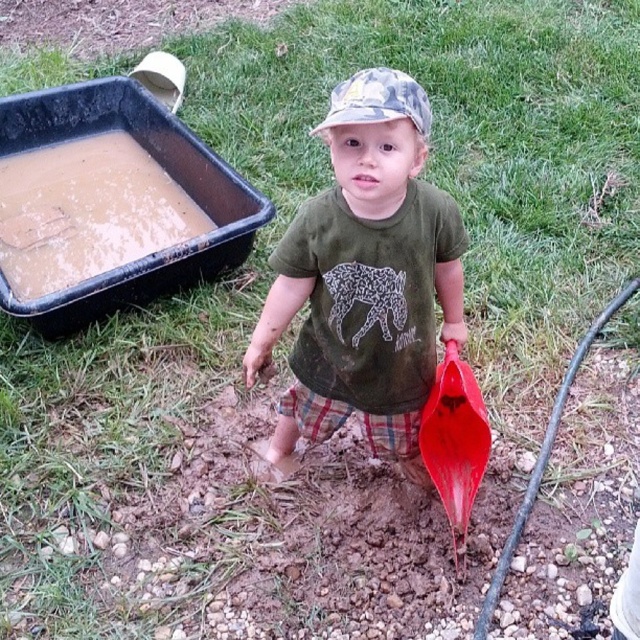
Based on the photo, does shiny plastic shovel at lower center have a lesser height compared to camouflage fabric cap at center?

No.

Is shiny plastic shovel at lower center smaller than camouflage fabric cap at center?

Incorrect, shiny plastic shovel at lower center is not smaller in size than camouflage fabric cap at center.

Find the location of `shiny plastic shovel at lower center`. shiny plastic shovel at lower center is located at coordinates (454, 444).

Which is below, green matte shirt at center or shiny plastic shovel at lower center?

Positioned lower is shiny plastic shovel at lower center.

Is point (349, 184) closer to viewer compared to point (464, 426)?

Yes, it is in front of point (464, 426).

Does point (406, 348) lie behind point (440, 474)?

No, it is not.

Locate an element on the screen. The image size is (640, 640). green matte shirt at center is located at coordinates (365, 278).

Is green matte shirt at center shorter than camouflage fabric cap at center?

No, green matte shirt at center is not shorter than camouflage fabric cap at center.

Does green matte shirt at center have a greater height compared to camouflage fabric cap at center?

Indeed, green matte shirt at center has a greater height compared to camouflage fabric cap at center.

What do you see at coordinates (365, 278) in the screenshot? I see `green matte shirt at center` at bounding box center [365, 278].

Find the location of a particular element. Image resolution: width=640 pixels, height=640 pixels. green matte shirt at center is located at coordinates (365, 278).